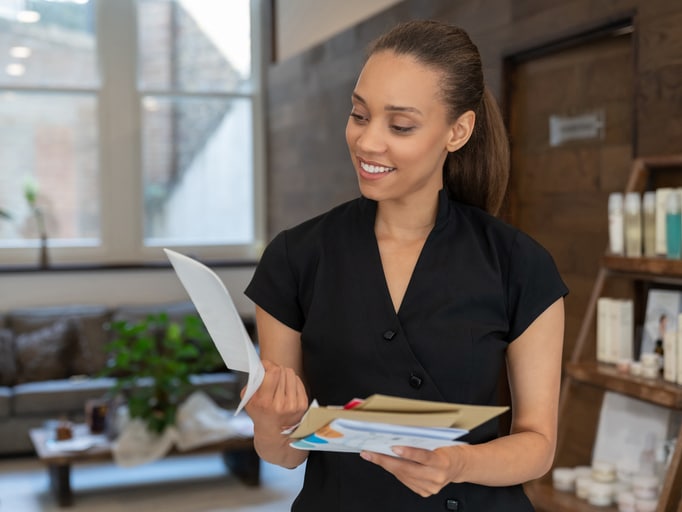
Find the location of `window`. window is located at coordinates (222, 37).